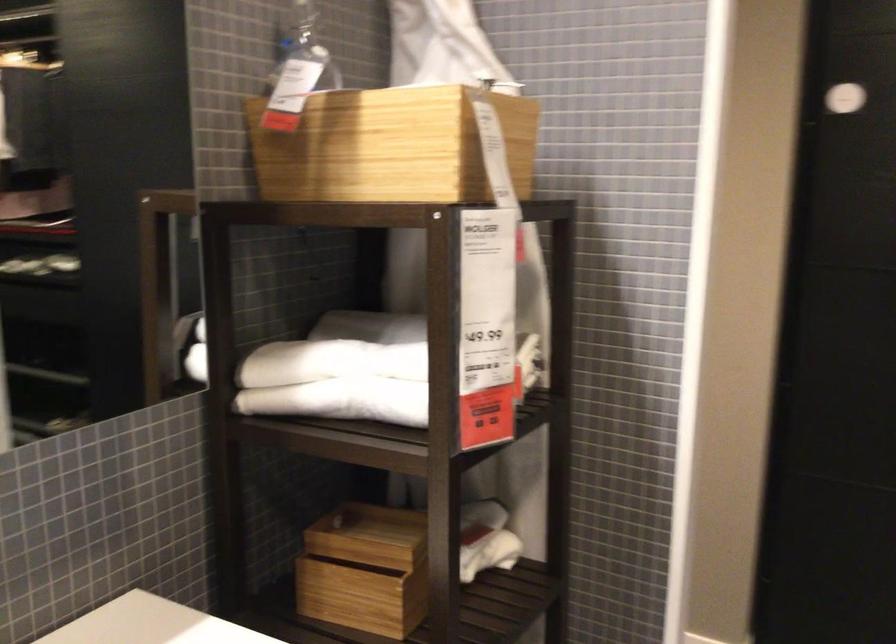
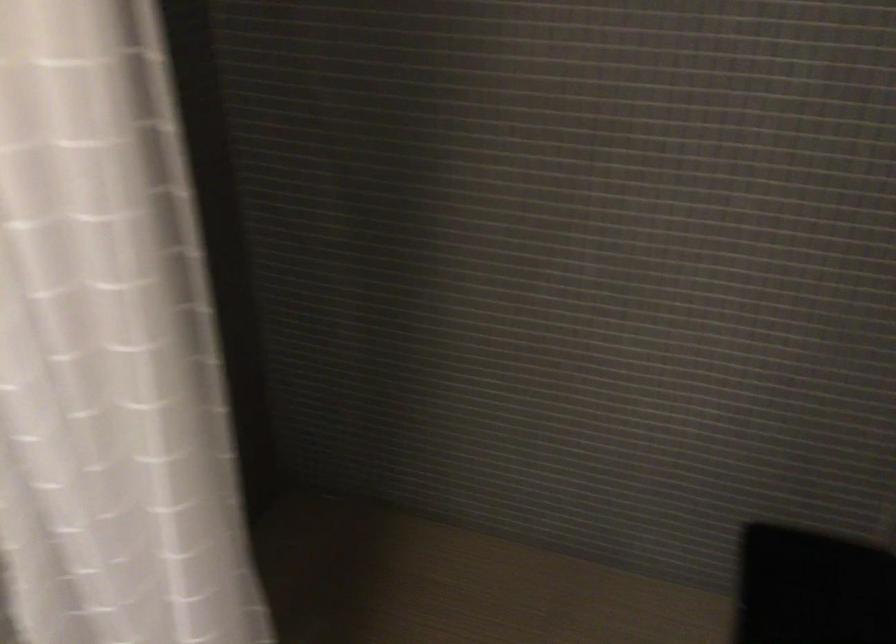
Based on the continuous images, in which direction is the camera rotating?

The rotation direction of the camera is right-down.